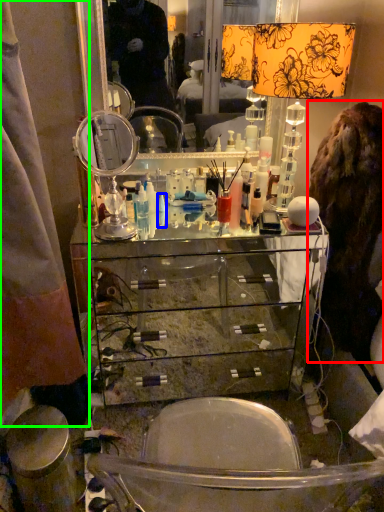
Question: Based on their relative distances, which object is nearer to fur coat (highlighted by a red box)? Choose from toiletry (highlighted by a blue box) and curtain (highlighted by a green box).

Choices:
 (A) toiletry
 (B) curtain

Answer: (A)